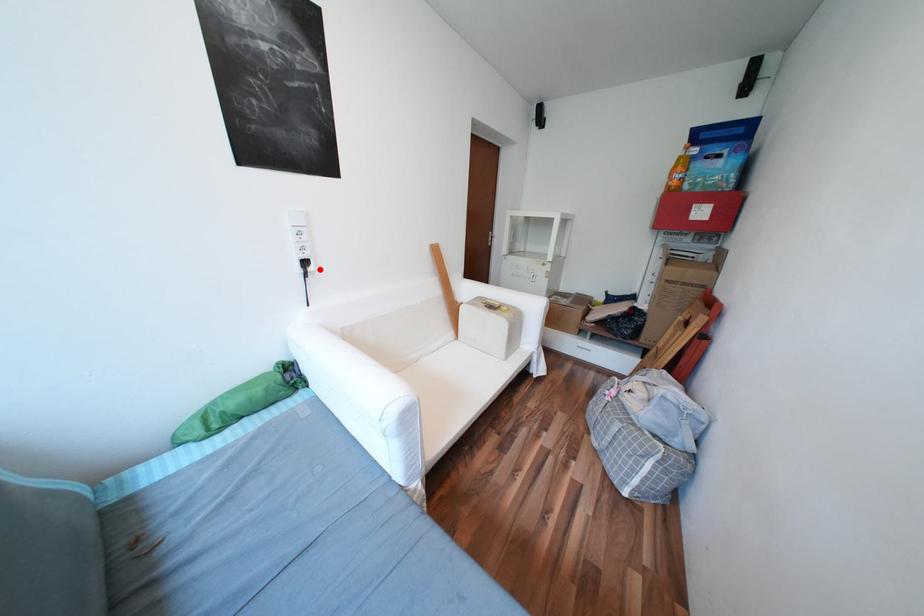
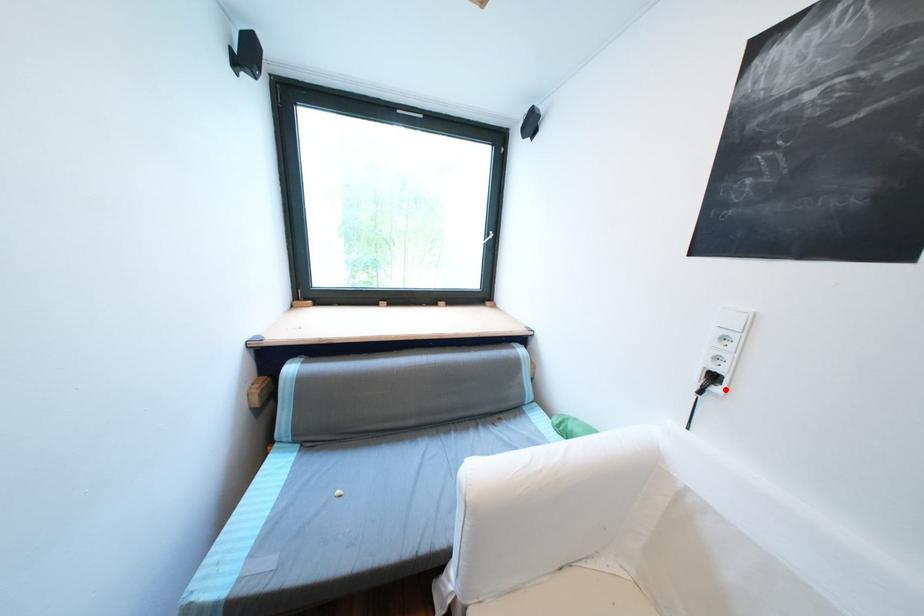
I am providing you with two images of the same scene from different viewpoints. A red point is marked on the first image and another point is marked on the second image. Does the point marked in image1 correspond to the same location as the one in image2?

Yes